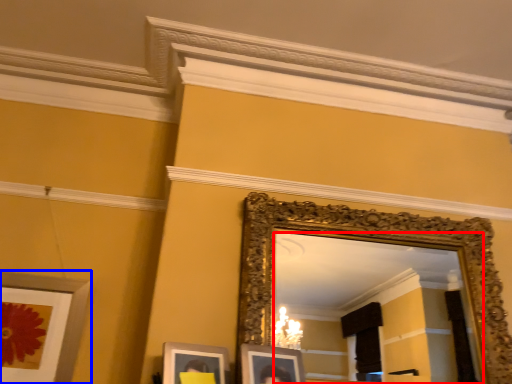
Question: Which object is closer to the camera taking this photo, mirror (highlighted by a red box) or picture frame (highlighted by a blue box)?

Choices:
 (A) mirror
 (B) picture frame

Answer: (A)